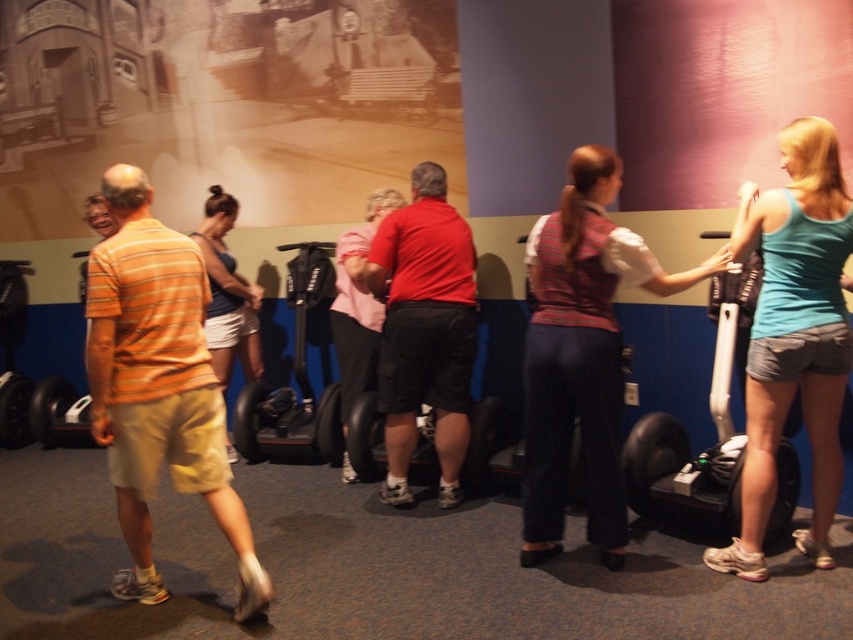
You are a photographer positioned at the back of the scene. You want to capture a photo where both the orange striped shirt at left and the red matte shirt at center are visible. Considering their heights, which person should you position closer to the camera to ensure both are fully visible in the frame?

To ensure both the orange striped shirt at left and the red matte shirt at center are fully visible, position the orange striped shirt at left closer to the camera since it has a lesser height compared to the red matte shirt at center. This adjustment will help balance their visibility in the photo.

Looking at this image, you are a photographer positioned at the entrance of the exhibit space. You want to capture a photo that includes both the teal fabric tank top at right and the matte blue tank top at center. Based on their positions, which one should you focus on first to ensure both are in frame?

The teal fabric tank top at right is in front of the matte blue tank top at center, so you should focus on the teal fabric tank top at right first to ensure both are in frame.